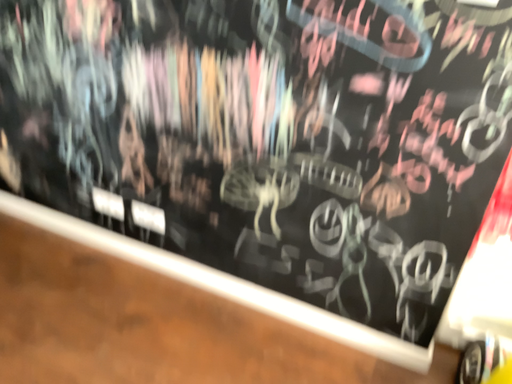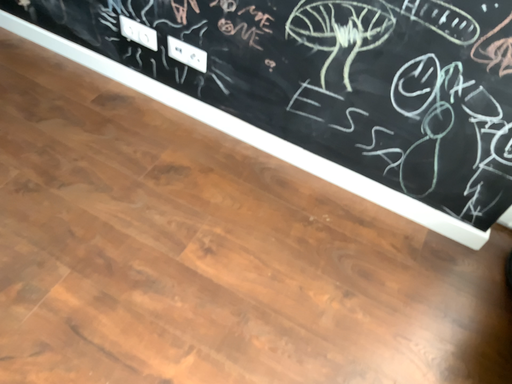
Question: How did the camera likely rotate when shooting the video?

Choices:
 (A) rotated downward
 (B) rotated upward

Answer: (A)